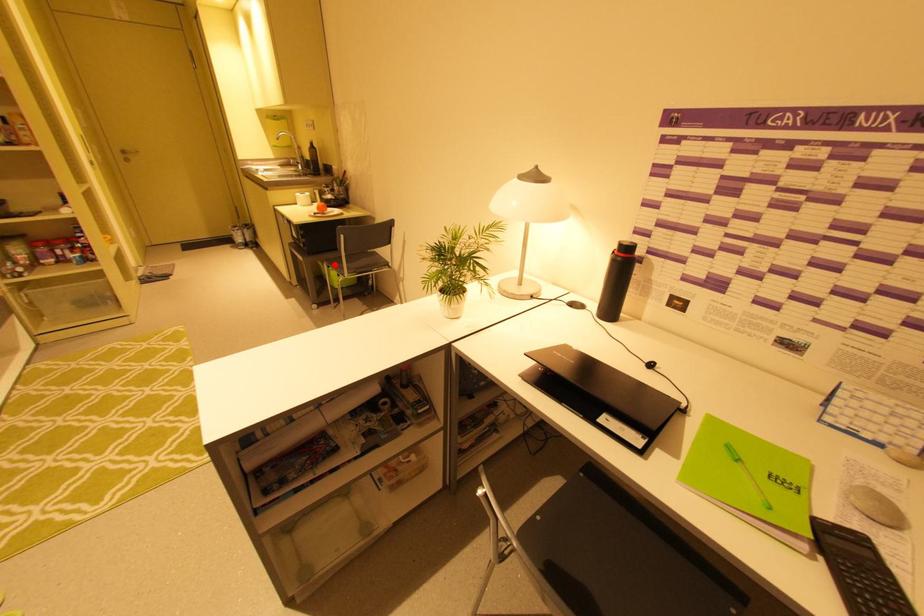
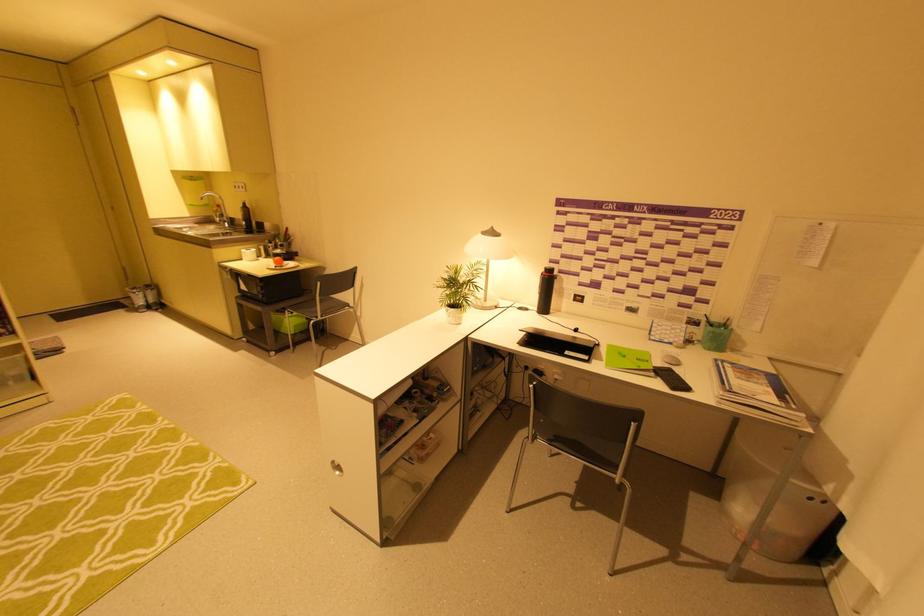
Where in the second image is the point corresponding to the highlighted location from the first image?

(299, 310)